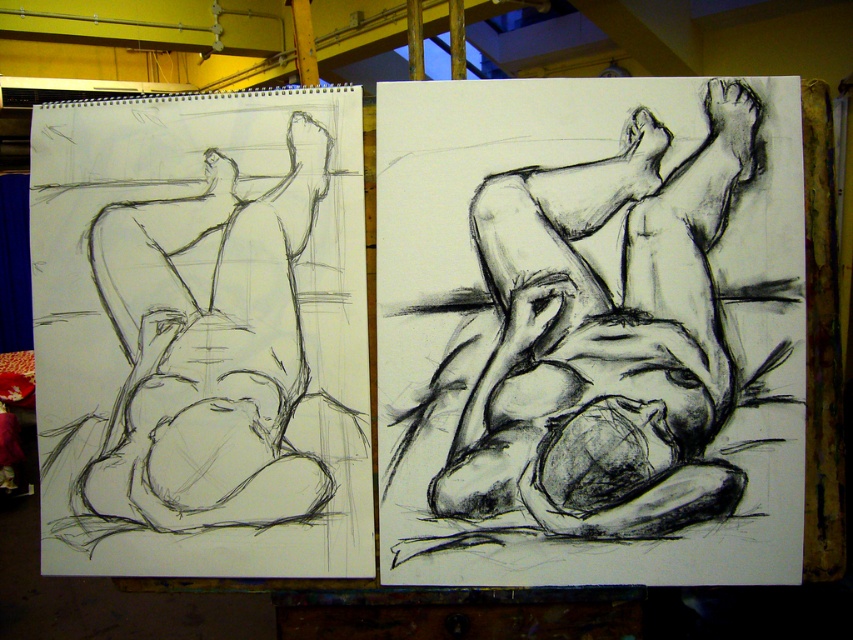
You are an art student who needs to place a 16 inch ruler between the charcoal sketch of reclining figure at center and the graphite sketch of reclining figure at left. Will the ruler fit between them?

The distance between the charcoal sketch of reclining figure at center and the graphite sketch of reclining figure at left is 15.50 inches. Since the ruler is 16 inches long, it will extend beyond the space between them by 0.5 inches.